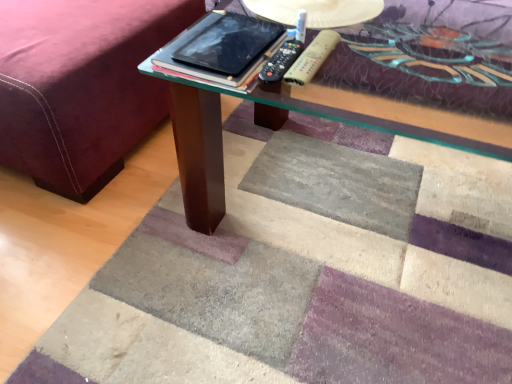
Question: In which direction should I rotate to look at wooden textured remote at center, the 1th remote from the right?

Choices:
 (A) left
 (B) right

Answer: (B)

Question: Is black glossy tablet at center located within wooden textured remote at center, placed as the second remote when sorted from left to right?

Choices:
 (A) no
 (B) yes

Answer: (A)

Question: Is wooden textured remote at center, placed as the second remote when sorted from left to right, facing towards black glossy tablet at center?

Choices:
 (A) no
 (B) yes

Answer: (A)

Question: From the image's perspective, is wooden textured remote at center, the 1th remote from the right, beneath black glossy tablet at center?

Choices:
 (A) yes
 (B) no

Answer: (A)

Question: Can you see wooden textured remote at center, placed as the second remote when sorted from left to right, touching black glossy tablet at center?

Choices:
 (A) no
 (B) yes

Answer: (A)

Question: Considering the relative sizes of wooden textured remote at center, the 1th remote from the right, and black glossy tablet at center in the image provided, is wooden textured remote at center, the 1th remote from the right, taller than black glossy tablet at center?

Choices:
 (A) yes
 (B) no

Answer: (A)

Question: Is wooden textured remote at center, placed as the second remote when sorted from left to right, further to the viewer compared to black glossy tablet at center?

Choices:
 (A) no
 (B) yes

Answer: (B)

Question: Is black plastic remote at center, which appears as the 2th remote when viewed from the right, at the right side of velvet maroon bed frame at lower left?

Choices:
 (A) yes
 (B) no

Answer: (A)

Question: From a real-world perspective, is black plastic remote at center, placed as the 1th remote when sorted from left to right, located higher than velvet maroon bed frame at lower left?

Choices:
 (A) yes
 (B) no

Answer: (A)

Question: From the image's perspective, would you say black plastic remote at center, which appears as the 2th remote when viewed from the right, is shown under velvet maroon bed frame at lower left?

Choices:
 (A) yes
 (B) no

Answer: (A)

Question: Would you say black plastic remote at center, placed as the 1th remote when sorted from left to right, is outside velvet maroon bed frame at lower left?

Choices:
 (A) no
 (B) yes

Answer: (B)

Question: Is the position of black plastic remote at center, which appears as the 2th remote when viewed from the right, less distant than that of velvet maroon bed frame at lower left?

Choices:
 (A) yes
 (B) no

Answer: (A)

Question: Can you confirm if black plastic remote at center, placed as the 1th remote when sorted from left to right, is positioned to the left of velvet maroon bed frame at lower left?

Choices:
 (A) yes
 (B) no

Answer: (B)

Question: Is wooden textured remote at center, the 1th remote from the right, located outside velvet maroon bed frame at lower left?

Choices:
 (A) yes
 (B) no

Answer: (A)